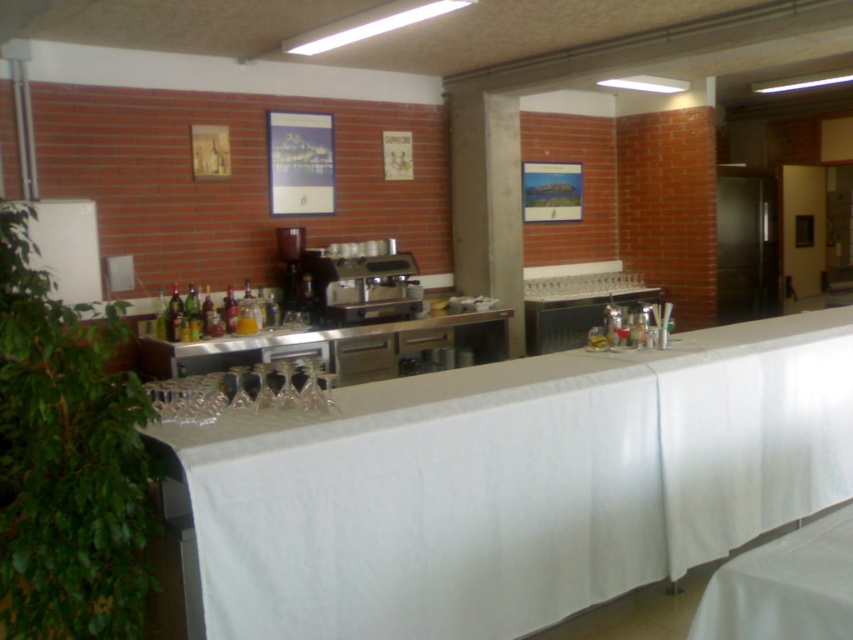
Question: Estimate the real-world distances between objects in this image. Which object is closer to the satin silver coffee machine at center?

Choices:
 (A) stainless steel counter at center
 (B) white fabric table at center

Answer: (A)

Question: Which of the following is the farthest from the observer?

Choices:
 (A) (300, 269)
 (B) (238, 358)

Answer: (A)

Question: Which object is closer to the camera taking this photo?

Choices:
 (A) white fabric table at center
 (B) satin silver coffee machine at center
 (C) stainless steel counter at center

Answer: (A)

Question: Can you confirm if white fabric table at center is positioned to the left of satin silver coffee machine at center?

Choices:
 (A) yes
 (B) no

Answer: (B)

Question: Is white fabric table at center positioned in front of satin silver coffee machine at center?

Choices:
 (A) yes
 (B) no

Answer: (A)

Question: In this image, where is white fabric table at center located relative to stainless steel counter at center?

Choices:
 (A) right
 (B) left

Answer: (A)